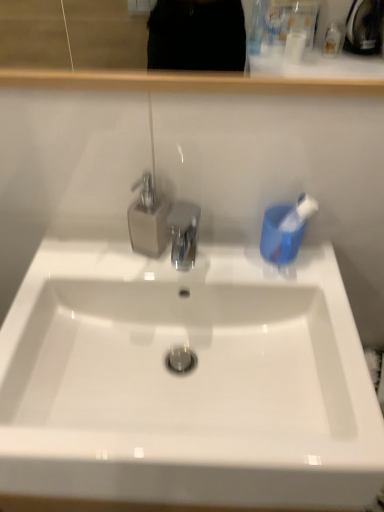
Question: Is white glossy sink at center aimed at transparent plastic tap at center?

Choices:
 (A) no
 (B) yes

Answer: (A)

Question: Can you confirm if white glossy sink at center is positioned to the right of transparent plastic tap at center?

Choices:
 (A) no
 (B) yes

Answer: (B)

Question: Considering the relative sizes of white glossy sink at center and transparent plastic tap at center in the image provided, is white glossy sink at center smaller than transparent plastic tap at center?

Choices:
 (A) no
 (B) yes

Answer: (A)

Question: From the image's perspective, does white glossy sink at center appear lower than transparent plastic tap at center?

Choices:
 (A) yes
 (B) no

Answer: (A)

Question: Can you confirm if white glossy sink at center is shorter than transparent plastic tap at center?

Choices:
 (A) no
 (B) yes

Answer: (B)

Question: Does white glossy sink at center appear on the left side of transparent plastic tap at center?

Choices:
 (A) yes
 (B) no

Answer: (B)

Question: Can you confirm if blue plastic toothbrush at right is thinner than transparent plastic tap at center?

Choices:
 (A) yes
 (B) no

Answer: (A)

Question: Would you say blue plastic toothbrush at right is outside transparent plastic tap at center?

Choices:
 (A) no
 (B) yes

Answer: (B)

Question: Considering the relative positions of blue plastic toothbrush at right and transparent plastic tap at center in the image provided, is blue plastic toothbrush at right to the left of transparent plastic tap at center from the viewer's perspective?

Choices:
 (A) no
 (B) yes

Answer: (A)

Question: Is blue plastic toothbrush at right not close to transparent plastic tap at center?

Choices:
 (A) yes
 (B) no

Answer: (B)

Question: Considering the relative positions of blue plastic toothbrush at right and transparent plastic tap at center in the image provided, is blue plastic toothbrush at right behind transparent plastic tap at center?

Choices:
 (A) no
 (B) yes

Answer: (B)

Question: Does blue plastic toothbrush at right come in front of transparent plastic tap at center?

Choices:
 (A) no
 (B) yes

Answer: (A)

Question: Is white glossy sink at center turned away from blue plastic toothbrush at right?

Choices:
 (A) no
 (B) yes

Answer: (A)